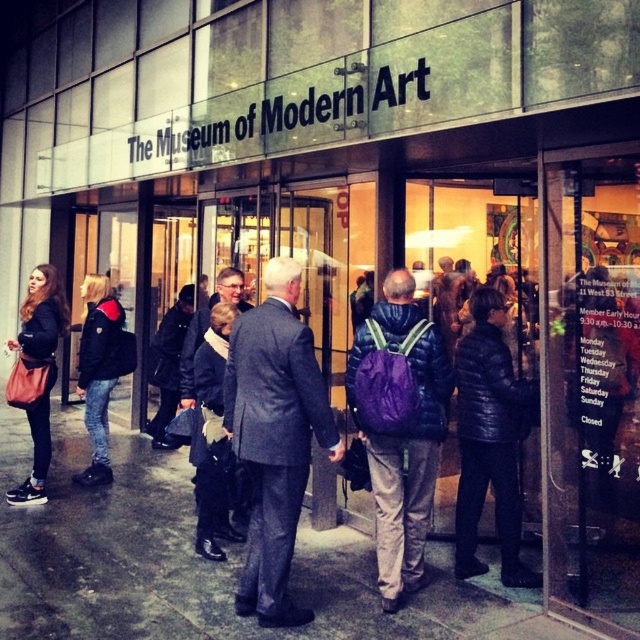
Question: Which of the following is the closest to the observer?

Choices:
 (A) gray wool suit at center
 (B) black leather jacket at left
 (C) matte black jacket at left
 (D) purple matte backpack at center

Answer: (A)

Question: Can you confirm if matte black jacket at left is wider than black leather jacket at left?

Choices:
 (A) yes
 (B) no

Answer: (B)

Question: Based on their relative distances, which object is nearer to the black leather jacket at left?

Choices:
 (A) dark blue puffer jacket at center
 (B) purple matte backpack at center

Answer: (B)

Question: Considering the real-world distances, which object is closest to the matte black jacket at left?

Choices:
 (A) purple matte backpack at center
 (B) black leather jacket at left
 (C) dark blue puffer jacket at center

Answer: (B)

Question: Can you confirm if matte black jacket at left is positioned to the left of black leather jacket at left?

Choices:
 (A) yes
 (B) no

Answer: (A)

Question: Can you confirm if purple matte backpack at center is positioned to the left of black leather jacket at left?

Choices:
 (A) no
 (B) yes

Answer: (A)